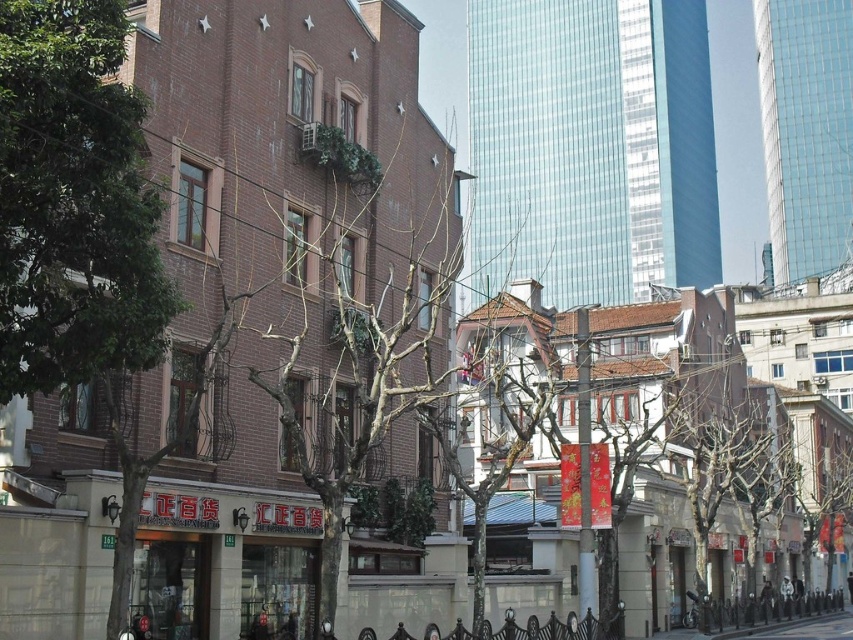
Please describe the position of the green leafy tree at upper left in terms of coordinates in the image. The image has a coordinate system where the top left corner is the origin point. The x and y coordinates range from 0 to 1. The x increases to the right, and y increases downward. The position is represented as a point with two decimal numbers between 0 and 1. The question must mention the coordinate system details. The answer must provide the coordinates exactly as given in the Objects Description. The

The green leafy tree at upper left is located at coordinates point (74, 202) in the image. This means it is positioned 31.6 percent to the right from the top left corner and 8.8 percent down from the top left corner.

From the picture: You are a pedestrian standing on the gray concrete pavement at lower center. Looking up, you notice the green leafy tree at upper left. Can you determine if the tree is directly above the pavement or shifted to one side?

The green leafy tree at upper left is positioned over gray concrete pavement at lower center, so it is directly above the pavement.

You are a city planner analyzing this street scene. You need to determine if the green leafy tree at upper left can provide shade over the gray concrete pavement at lower center during midday. Based on their relative sizes and positions, what is your assessment?

The green leafy tree at upper left is taller than the gray concrete pavement at lower center. Since the tree is taller, it is likely that its branches and leaves can cast shade over the gray concrete pavement at lower center during midday when the sun is high.